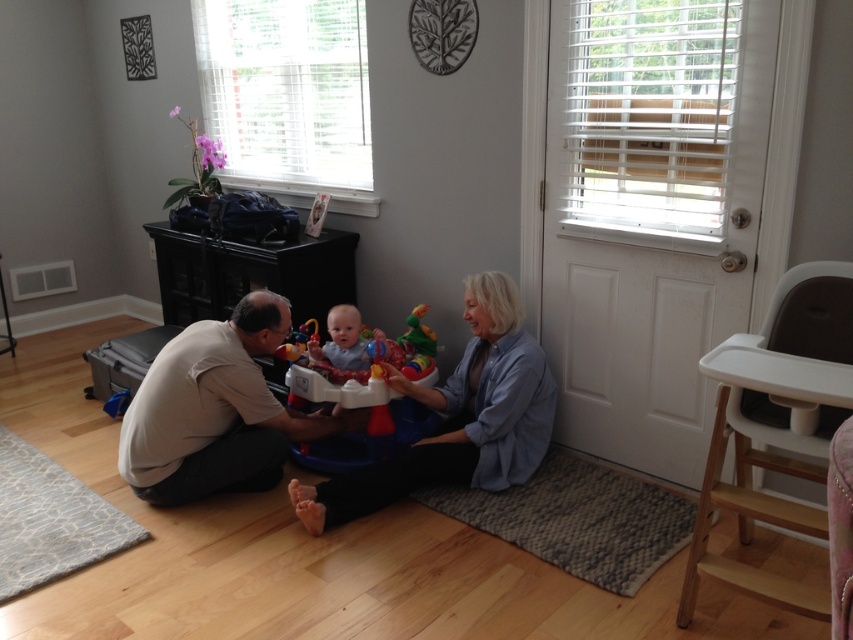
Question: Is blue cotton shirt at center smaller than blue soft baby walker at center?

Choices:
 (A) no
 (B) yes

Answer: (A)

Question: Can you confirm if white plastic high chair at right is positioned above light beige shirt at lower left?

Choices:
 (A) no
 (B) yes

Answer: (B)

Question: Which point is farther to the camera?

Choices:
 (A) light beige shirt at lower left
 (B) white plastic high chair at right
 (C) blue soft baby walker at center

Answer: (C)

Question: Estimate the real-world distances between objects in this image. Which object is farther from the blue cotton shirt at center?

Choices:
 (A) blue soft baby walker at center
 (B) light beige shirt at lower left
 (C) white plastic high chair at right
 (D) plastic colorful walker at center

Answer: (C)

Question: Among these points, which one is farthest from the camera?

Choices:
 (A) (404, 392)
 (B) (262, 474)
 (C) (334, 323)
 (D) (358, 333)

Answer: (D)

Question: Can you confirm if light beige shirt at lower left is positioned to the left of blue cotton shirt at center?

Choices:
 (A) yes
 (B) no

Answer: (A)